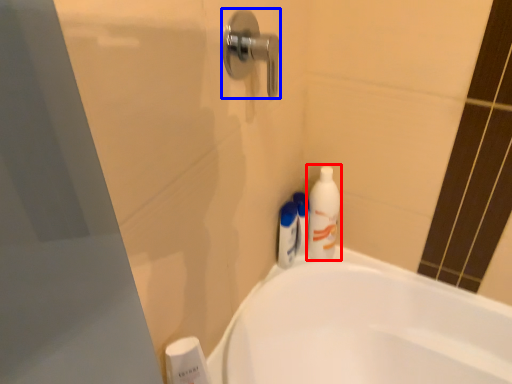
Question: Which object is further to the camera taking this photo, cleaning product (highlighted by a red box) or door handle (highlighted by a blue box)?

Choices:
 (A) cleaning product
 (B) door handle

Answer: (A)